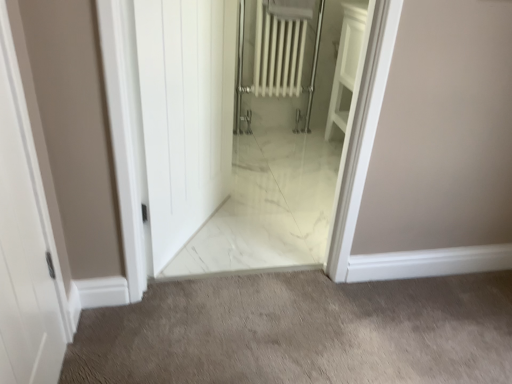
Measure the distance between white glossy door at center, the 2th door when ordered from left to right, and camera.

They are 3.69 feet apart.

Measure the distance between white marble elevator at center and camera.

white marble elevator at center and camera are 1.13 meters apart from each other.

At what (x,y) coordinates should I click in order to perform the action: click on white glossy door at center, arranged as the 1th door when viewed from the right. Please return your answer as a coordinate pair (x, y). The width and height of the screenshot is (512, 384). Looking at the image, I should click on (185, 113).

From the image's perspective, which is above, white glossy door at center, arranged as the 1th door when viewed from the right, or white marble floor at center?

From the image's view, white glossy door at center, arranged as the 1th door when viewed from the right, is above.

Can you confirm if white glossy door at center, arranged as the 1th door when viewed from the right, is smaller than white marble floor at center?

No, white glossy door at center, arranged as the 1th door when viewed from the right, is not smaller than white marble floor at center.

From a real-world perspective, which object rests below the other?

From a 3D spatial view, white marble floor at center is below.

In the image, is white glossy door at center, the 2th door when ordered from left to right, positioned in front of or behind white marble floor at center?

Visually, white glossy door at center, the 2th door when ordered from left to right, is located behind white marble floor at center.

Considering the sizes of white marble elevator at center and white glossy door at center, placed as the 2th door when sorted from front to back, in the image, is white marble elevator at center taller or shorter than white glossy door at center, placed as the 2th door when sorted from front to back,?

In the image, white marble elevator at center appears to be taller than white glossy door at center, placed as the 2th door when sorted from front to back.

Who is smaller, white marble elevator at center or white glossy door at center, the 2th door when ordered from left to right?

white marble elevator at center.

From a real-world perspective, is white marble elevator at center above or below white glossy door at center, placed as the 2th door when sorted from front to back?

white marble elevator at center is situated higher than white glossy door at center, placed as the 2th door when sorted from front to back, in the real world.

In the image, is white marble elevator at center positioned in front of or behind white glossy door at center, placed as the 2th door when sorted from front to back?

Clearly, white marble elevator at center is in front of white glossy door at center, placed as the 2th door when sorted from front to back.

In the scene shown: Which of these two, white matte door at left, which ranks as the 2th door in right-to-left order, or white marble elevator at center, is wider?

With larger width is white marble elevator at center.

From the image's perspective, is white matte door at left, marked as the 1th door in a front-to-back arrangement, beneath white marble elevator at center?

Yes.

From a real-world perspective, does white matte door at left, the 1th door from the left, stand above white marble elevator at center?

No, from a real-world perspective, white matte door at left, the 1th door from the left, is not over white marble elevator at center

Are white matte door at left, the second door in the back-to-front sequence, and white marble elevator at center far apart?

That's not correct — white matte door at left, the second door in the back-to-front sequence, is a little close to white marble elevator at center.

Would you consider white marble elevator at center to be distant from white matte door at left, which ranks as the 2th door in right-to-left order?

No.

Consider the image. Is white marble elevator at center facing away from white matte door at left, the second door in the back-to-front sequence?

No, white marble elevator at center's orientation is not away from white matte door at left, the second door in the back-to-front sequence.

Which object is further away from the camera taking this photo, white marble elevator at center or white matte door at left, marked as the 1th door in a front-to-back arrangement?

Positioned behind is white marble elevator at center.

Does white marble floor at center lie in front of white marble elevator at center?

No, white marble floor at center is further to the viewer.

Is white marble floor at center oriented away from white marble elevator at center?

No, white marble floor at center's orientation is not away from white marble elevator at center.

Is white marble floor at center inside or outside of white marble elevator at center?

white marble floor at center lies outside white marble elevator at center.

Which point is more distant from viewer, (x=305, y=368) or (x=295, y=221)?

The point (x=295, y=221) is farther from the camera.

Who is taller, white matte door at left, the 1th door from the left, or white glossy door at center, the 2th door when ordered from left to right?

With more height is white glossy door at center, the 2th door when ordered from left to right.

Considering the relative sizes of white matte door at left, marked as the 1th door in a front-to-back arrangement, and white glossy door at center, placed as the 2th door when sorted from front to back, in the image provided, is white matte door at left, marked as the 1th door in a front-to-back arrangement, bigger than white glossy door at center, placed as the 2th door when sorted from front to back,?

No.

You are a GUI agent. You are given a task and a screenshot of the screen. Output one action in this format:
    pyautogui.click(x=<x>, y=<y>)
    Task: Click on the door behind the white matte door at left, the 1th door from the left
    The width and height of the screenshot is (512, 384).
    Given the screenshot: What is the action you would take?
    pyautogui.click(x=185, y=113)

Could you tell me if white matte door at left, which ranks as the 2th door in right-to-left order, is facing white glossy door at center, marked as the 1th door in a back-to-front arrangement?

No, white matte door at left, which ranks as the 2th door in right-to-left order, is not aimed at white glossy door at center, marked as the 1th door in a back-to-front arrangement.

Which object is more forward, white marble floor at center or white matte door at left, marked as the 1th door in a front-to-back arrangement?

Positioned in front is white matte door at left, marked as the 1th door in a front-to-back arrangement.

Can you confirm if white marble floor at center is thinner than white matte door at left, marked as the 1th door in a front-to-back arrangement?

No, white marble floor at center is not thinner than white matte door at left, marked as the 1th door in a front-to-back arrangement.

Between white marble floor at center and white matte door at left, marked as the 1th door in a front-to-back arrangement, which one has smaller size?

Smaller between the two is white matte door at left, marked as the 1th door in a front-to-back arrangement.

Is white marble floor at center inside or outside of white matte door at left, which ranks as the 2th door in right-to-left order?

white marble floor at center is not enclosed by white matte door at left, which ranks as the 2th door in right-to-left order.

At what (x,y) coordinates should I click in order to perform the action: click on the 2nd door above the white marble floor at center (from a real-world perspective). Please return your answer as a coordinate pair (x, y). The height and width of the screenshot is (384, 512). Looking at the image, I should click on (185, 113).

Identify the location of elevator on the right of the white glossy door at center, placed as the 2th door when sorted from front to back. This screenshot has width=512, height=384. (245, 128).

Based on their spatial positions, is white marble floor at center or white matte door at left, which ranks as the 2th door in right-to-left order, closer to white glossy door at center, arranged as the 1th door when viewed from the right?

white matte door at left, which ranks as the 2th door in right-to-left order, is closer to white glossy door at center, arranged as the 1th door when viewed from the right.

Which object lies nearer to the anchor point white matte door at left, which ranks as the 2th door in right-to-left order, white glossy door at center, placed as the 2th door when sorted from front to back, or white marble elevator at center?

white glossy door at center, placed as the 2th door when sorted from front to back, lies closer to white matte door at left, which ranks as the 2th door in right-to-left order, than the other object.

Considering their positions, is white matte door at left, the second door in the back-to-front sequence, positioned closer to white marble floor at center than white glossy door at center, the 2th door when ordered from left to right?

Among the two, white matte door at left, the second door in the back-to-front sequence, is located nearer to white marble floor at center.

From the image, which object appears to be farther from white glossy door at center, the 2th door when ordered from left to right, white matte door at left, which ranks as the 2th door in right-to-left order, or white marble elevator at center?

Based on the image, white matte door at left, which ranks as the 2th door in right-to-left order, appears to be further to white glossy door at center, the 2th door when ordered from left to right.

When comparing their distances from white marble floor at center, does white glossy door at center, placed as the 2th door when sorted from front to back, or white matte door at left, which ranks as the 2th door in right-to-left order, seem closer?

white matte door at left, which ranks as the 2th door in right-to-left order.

Looking at the image, which one is located further to white marble floor at center, white marble elevator at center or white glossy door at center, marked as the 1th door in a back-to-front arrangement?

The object further to white marble floor at center is white marble elevator at center.

Considering their positions, is white glossy door at center, marked as the 1th door in a back-to-front arrangement, positioned closer to white matte door at left, the 1th door from the left, than white marble floor at center?

white glossy door at center, marked as the 1th door in a back-to-front arrangement, is positioned closer to the anchor white matte door at left, the 1th door from the left.

Estimate the real-world distances between objects in this image. Which object is closer to white marble elevator at center, white matte door at left, marked as the 1th door in a front-to-back arrangement, or white glossy door at center, arranged as the 1th door when viewed from the right?

white glossy door at center, arranged as the 1th door when viewed from the right.

The height and width of the screenshot is (384, 512). In order to click on elevator between white matte door at left, which ranks as the 2th door in right-to-left order, and white marble floor at center from left to right in this screenshot , I will do `click(245, 128)`.

Where is `door situated between white matte door at left, the second door in the back-to-front sequence, and white marble floor at center from left to right`? This screenshot has height=384, width=512. door situated between white matte door at left, the second door in the back-to-front sequence, and white marble floor at center from left to right is located at coordinates (185, 113).

The image size is (512, 384). Find the location of `elevator that lies between white glossy door at center, arranged as the 1th door when viewed from the right, and white marble floor at center from top to bottom`. elevator that lies between white glossy door at center, arranged as the 1th door when viewed from the right, and white marble floor at center from top to bottom is located at coordinates (245, 128).

Image resolution: width=512 pixels, height=384 pixels. Identify the location of elevator between white matte door at left, marked as the 1th door in a front-to-back arrangement, and white glossy door at center, arranged as the 1th door when viewed from the right, along the z-axis. (245, 128).